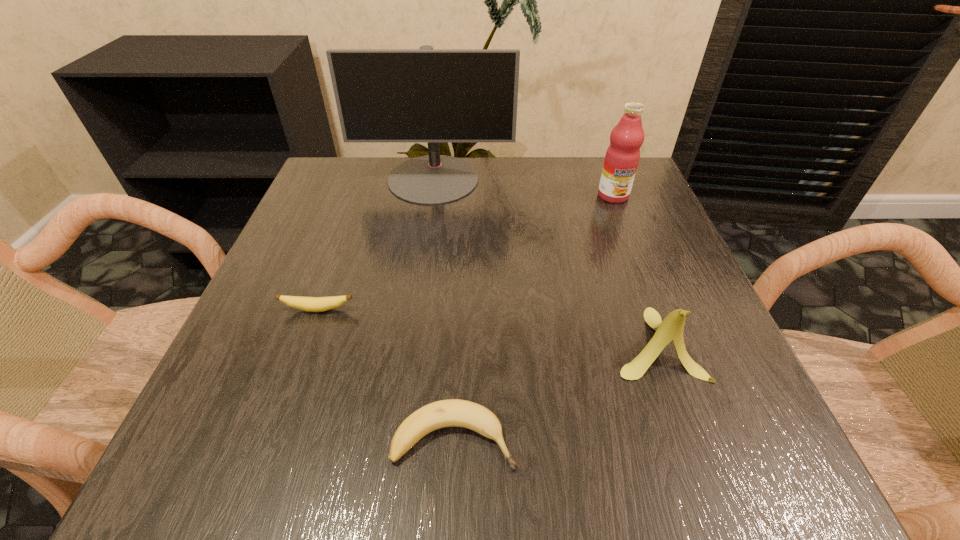
Identify the location of object that is at the far right corner. (622, 156).

Where is `vacant region at the far edge of the desktop`? The image size is (960, 540). vacant region at the far edge of the desktop is located at coordinates (500, 206).

The height and width of the screenshot is (540, 960). What are the coordinates of `vacant region at the near edge of the desktop` in the screenshot? It's located at (541, 482).

The height and width of the screenshot is (540, 960). In the image, there is a desktop. Find the location of `vacant space at the left edge`. vacant space at the left edge is located at coordinates (273, 264).

This screenshot has width=960, height=540. I want to click on vacant area at the right edge, so click(689, 376).

Find the location of a particular element. vacant space at the near left corner of the desktop is located at coordinates (202, 434).

Locate an element on the screen. The image size is (960, 540). free region at the far right corner of the desktop is located at coordinates (574, 165).

At what (x,y) coordinates should I click in order to perform the action: click on vacant point located between the leftmost banana and the computer monitor. Please return your answer as a coordinate pair (x, y). Image resolution: width=960 pixels, height=540 pixels. Looking at the image, I should click on (375, 244).

At what (x,y) coordinates should I click in order to perform the action: click on free area in between the nearest banana and the tallest object. Please return your answer as a coordinate pair (x, y). The height and width of the screenshot is (540, 960). Looking at the image, I should click on (444, 309).

Locate an element on the screen. This screenshot has width=960, height=540. vacant area that lies between the leftmost banana and the tallest object is located at coordinates (375, 244).